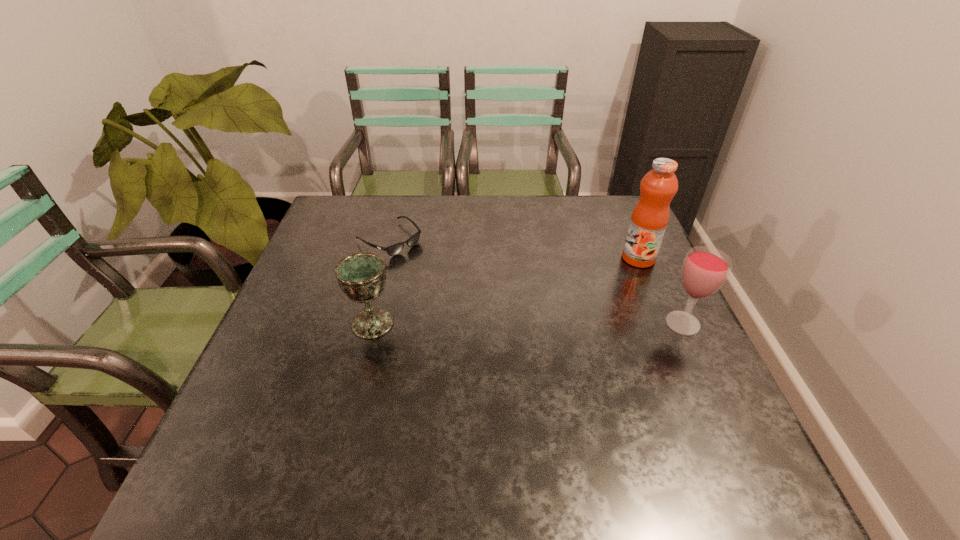
The width and height of the screenshot is (960, 540). I want to click on vacant space on the desktop that is between the chalice and the wineglass and is positioned on the front-facing side of the shortest object, so click(505, 323).

Locate an element on the screen. The width and height of the screenshot is (960, 540). free space on the desktop that is between the chalice and the wineglass and is positioned on the front label of the fruit juice is located at coordinates (x=514, y=323).